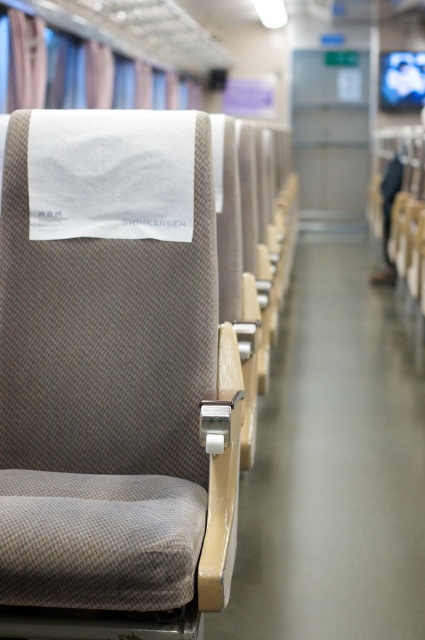
You are a passenger on the train and need to determine if your backpack can fit between the textured beige seat at center and the blue fabric curtain at upper left. The backpack measures 40 cm in width. Can it fit?

The textured beige seat at center has a smaller size compared to blue fabric curtain at upper left. Since the backpack is 40 cm wide, it depends on the available space between them. However, the description only mentions their relative sizes, not the exact distance. Without specific measurements of the gap, it is uncertain if the backpack will fit.

You are a passenger on the train and want to find your seat. You see a blue fabric curtain at upper left and a textured beige seat at center. Which one is closer to the aisle?

The textured beige seat at center is closer to the aisle because it is to the right of the blue fabric curtain at upper left, which is positioned further away from the aisle.